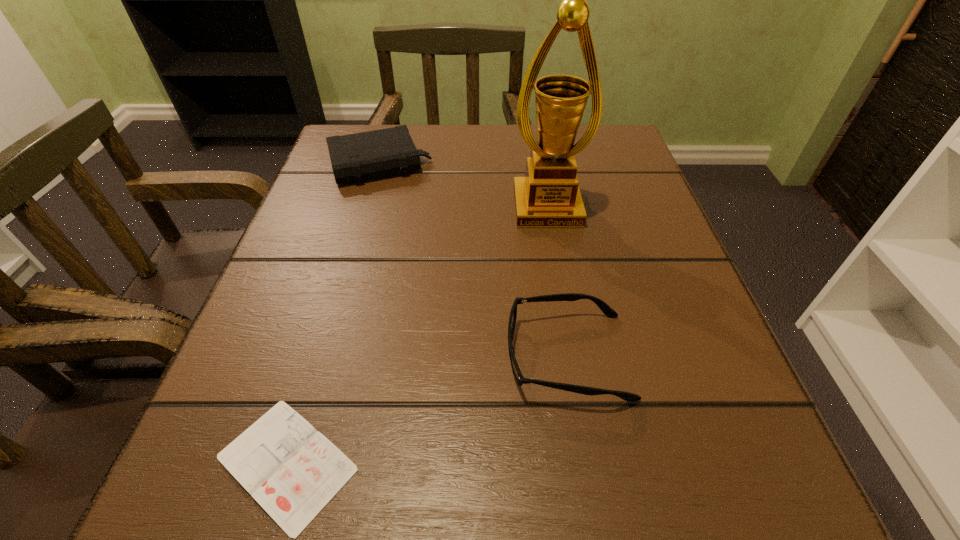
At what (x,y) coordinates should I click in order to perform the action: click on object situated at the far edge. Please return your answer as a coordinate pair (x, y). Image resolution: width=960 pixels, height=540 pixels. Looking at the image, I should click on (355, 157).

This screenshot has height=540, width=960. Find the location of `object that is at the near edge`. object that is at the near edge is located at coordinates (293, 471).

This screenshot has width=960, height=540. What are the coordinates of `Bible that is at the left edge` in the screenshot? It's located at (355, 157).

Find the location of a particular element. This screenshot has height=540, width=960. diary that is at the left edge is located at coordinates (293, 471).

This screenshot has height=540, width=960. Find the location of `award that is positioned at the right edge`. award that is positioned at the right edge is located at coordinates (549, 196).

Find the location of a particular element. The width and height of the screenshot is (960, 540). spectacles that is at the right edge is located at coordinates (606, 309).

Locate an element on the screen. This screenshot has height=540, width=960. object situated at the far left corner is located at coordinates (355, 157).

In order to click on object at the near left corner in this screenshot , I will do `click(293, 471)`.

The width and height of the screenshot is (960, 540). In the image, there is a desktop. Identify the location of vacant space at the far edge. (470, 149).

You are a GUI agent. You are given a task and a screenshot of the screen. Output one action in this format:
    pyautogui.click(x=<x>, y=<y>)
    Task: Click on the vacant space at the near edge of the desktop
    
    Given the screenshot: What is the action you would take?
    pyautogui.click(x=565, y=456)